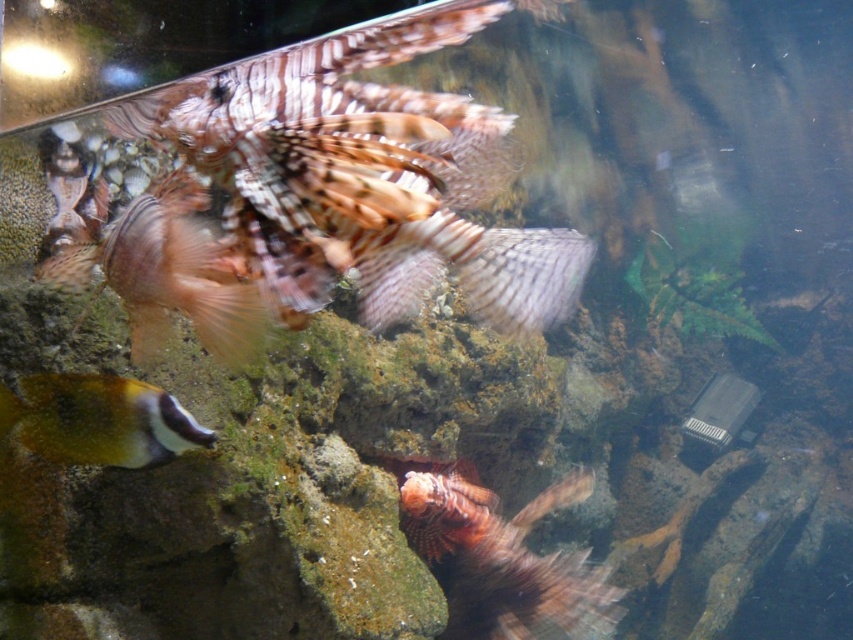
Question: In this image, where is speckled brown fish at center located relative to speckled yellow fish at lower left?

Choices:
 (A) above
 (B) below

Answer: (A)

Question: Based on their relative distances, which object is farther from the orange spiky fin at center?

Choices:
 (A) multicolored feathery fish at upper left
 (B) speckled brown fish at center

Answer: (B)

Question: Among these points, which one is farthest from the camera?

Choices:
 (A) (573, 474)
 (B) (132, 241)

Answer: (A)

Question: Does speckled brown fish at center have a lesser width compared to orange spiky fin at center?

Choices:
 (A) no
 (B) yes

Answer: (B)

Question: Among these objects, which one is nearest to the camera?

Choices:
 (A) speckled brown fish at center
 (B) speckled yellow fish at lower left
 (C) orange spiky fin at center
 (D) multicolored feathery fish at upper left

Answer: (A)

Question: Does multicolored feathery fish at upper left appear on the right side of speckled yellow fish at lower left?

Choices:
 (A) no
 (B) yes

Answer: (B)